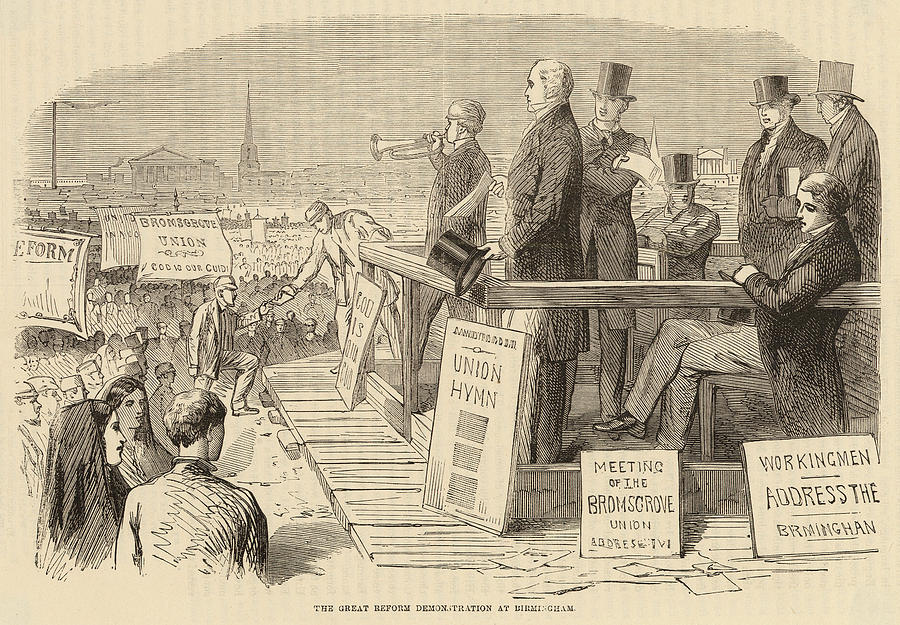
This screenshot has width=900, height=625. In order to click on wooden board in this screenshot , I will do `click(410, 535)`.